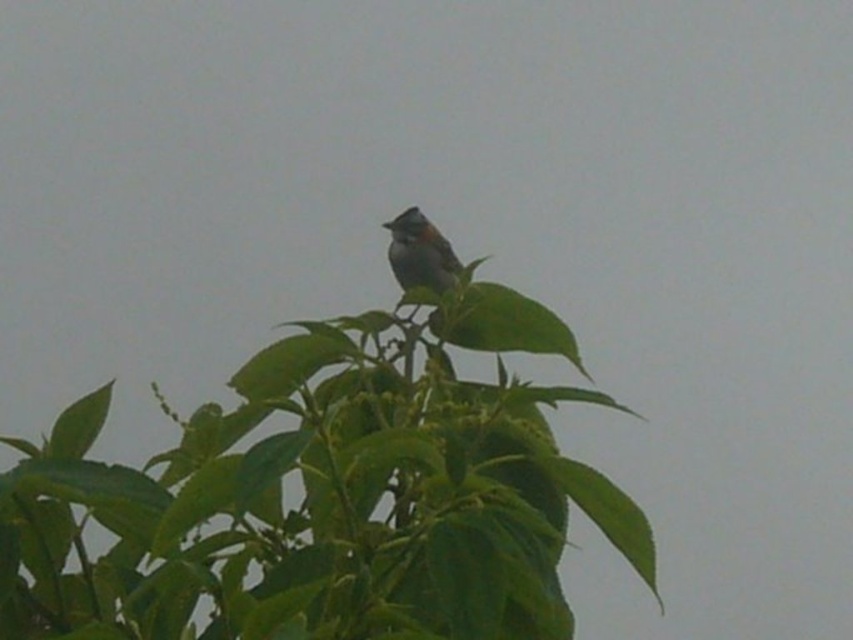
You are observing a bird in a tree. The bird is on a branch in the center of the image, and there is a green leafy tree at upper center. Based on their positions, which object is higher in the image?

The green leafy tree at upper center is higher in the image because it is located at point (326,497), which places it higher vertically compared to the bird positioned centrally.

You are observing a bird in a tree and want to determine the distance between two points in the image. The first point is point (556, 637) and the second is point (451, 280). Which point is nearer to you?

Point (556, 637) is closer to the viewer than point (451, 280).

You are a birdwatcher observing the scene. You notice the green leafy tree at upper center and the brown speckled bird at center. Which object is located to the left of the other?

The green leafy tree at upper center is positioned on the left side of brown speckled bird at center.